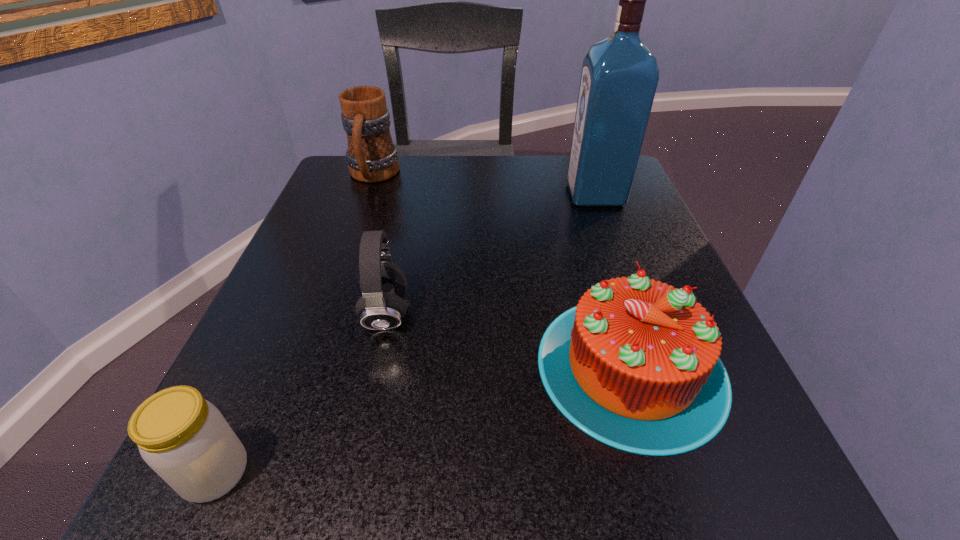
In order to click on free space located on the left of the cake in this screenshot , I will do `click(260, 366)`.

Locate an element on the screen. This screenshot has width=960, height=540. free region located 0.160m on the right of the jar is located at coordinates (387, 473).

Find the location of a particular element. liquor positioned at the far edge is located at coordinates point(619,78).

Where is `mug situated at the far edge`? This screenshot has width=960, height=540. mug situated at the far edge is located at coordinates tap(371, 156).

Locate an element on the screen. This screenshot has height=540, width=960. cake that is at the near edge is located at coordinates (635, 365).

You are a GUI agent. You are given a task and a screenshot of the screen. Output one action in this format:
    pyautogui.click(x=<x>, y=<y>)
    Task: Click on the jar positioned at the near edge
    The height and width of the screenshot is (540, 960).
    Given the screenshot: What is the action you would take?
    pyautogui.click(x=184, y=438)

What are the coordinates of `mug positioned at the left edge` in the screenshot? It's located at (371, 156).

I want to click on headset located at the left edge, so click(x=383, y=285).

The width and height of the screenshot is (960, 540). I want to click on jar that is at the left edge, so click(x=184, y=438).

The height and width of the screenshot is (540, 960). In order to click on liquor that is at the right edge in this screenshot , I will do `click(619, 78)`.